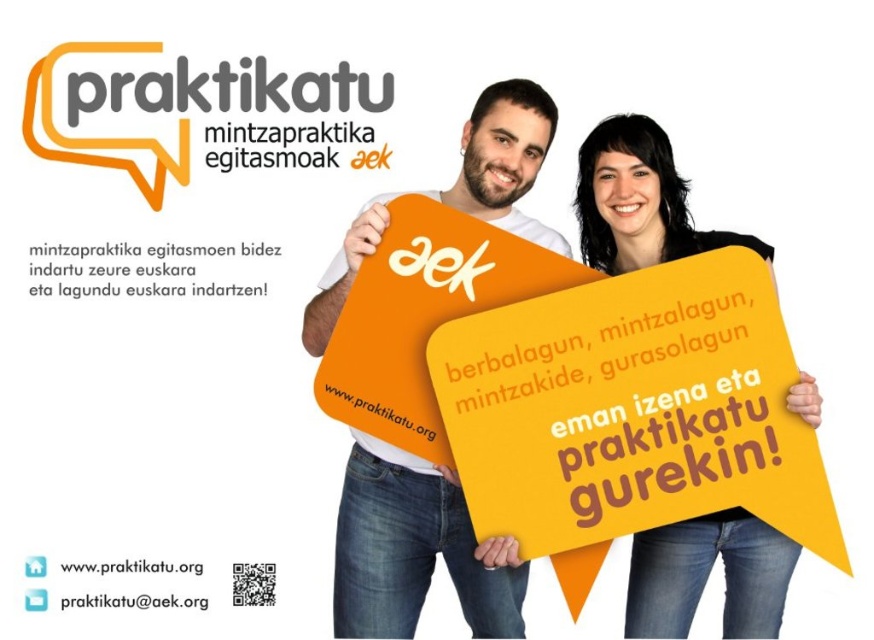
Can you confirm if yellow matte sign at center is wider than matte orange speech bubble at upper center?

In fact, yellow matte sign at center might be narrower than matte orange speech bubble at upper center.

Is yellow matte sign at center positioned before matte orange speech bubble at upper center?

Yes, it is in front of matte orange speech bubble at upper center.

Between point (682, 589) and point (282, 134), which one is positioned behind?

Point (282, 134)

Where is `yellow matte sign at center`? Image resolution: width=874 pixels, height=640 pixels. yellow matte sign at center is located at coordinates (708, 573).

What do you see at coordinates (708, 573) in the screenshot?
I see `yellow matte sign at center` at bounding box center [708, 573].

Can you confirm if yellow matte sign at center is positioned to the left of white paper at lower left?

In fact, yellow matte sign at center is to the right of white paper at lower left.

The width and height of the screenshot is (874, 640). What do you see at coordinates (708, 573) in the screenshot?
I see `yellow matte sign at center` at bounding box center [708, 573].

Where is `yellow matte sign at center`? This screenshot has height=640, width=874. yellow matte sign at center is located at coordinates (708, 573).

Is point (626, 198) positioned after point (399, 401)?

Yes, it is.

Between yellow matte sign at center and white paper at center, which one is positioned lower?

Positioned lower is yellow matte sign at center.

Is point (678, 193) farther from camera compared to point (403, 433)?

That is True.

Image resolution: width=874 pixels, height=640 pixels. Find the location of `yellow matte sign at center`. yellow matte sign at center is located at coordinates (708, 573).